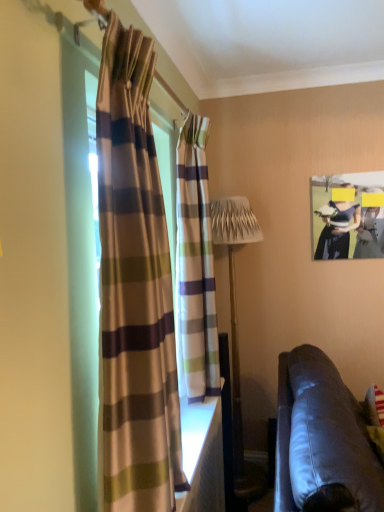
Question: From a real-world perspective, relative to leather couch at lower right, is metallic silver table lamp at center vertically above or below?

Choices:
 (A) below
 (B) above

Answer: (B)

Question: Looking at their shapes, would you say metallic silver table lamp at center is wider or thinner than leather couch at lower right?

Choices:
 (A) wide
 (B) thin

Answer: (B)

Question: Which is nearer to the metallic silver table lamp at center?

Choices:
 (A) striped fabric curtain at center, which is counted as the second curtain, starting from the front
 (B) matte black hat at upper right
 (C) leather couch at lower right
 (D) striped fabric curtain at left, which appears as the first curtain when viewed from the front

Answer: (A)

Question: Estimate the real-world distances between objects in this image. Which object is farther from the striped fabric curtain at left, which appears as the first curtain when viewed from the front?

Choices:
 (A) leather couch at lower right
 (B) matte black hat at upper right
 (C) striped fabric curtain at center, which is counted as the second curtain, starting from the front
 (D) metallic silver table lamp at center

Answer: (B)